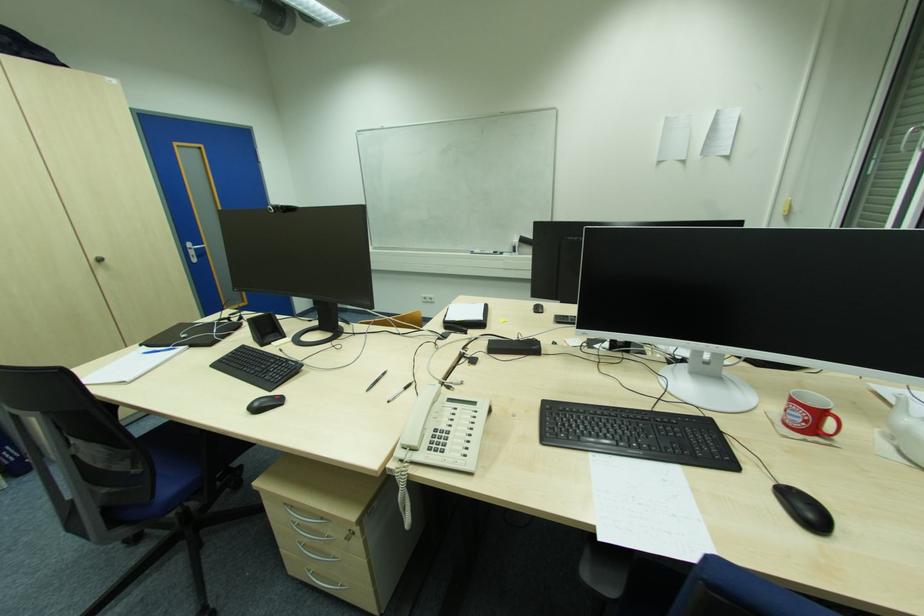
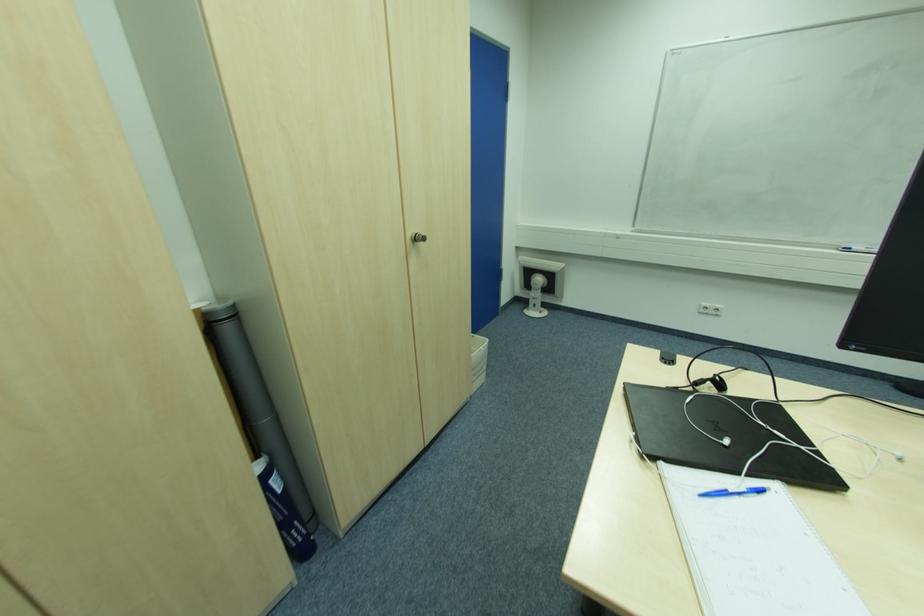
Locate, in the second image, the point that corresponds to (x=161, y=353) in the first image.

(727, 493)